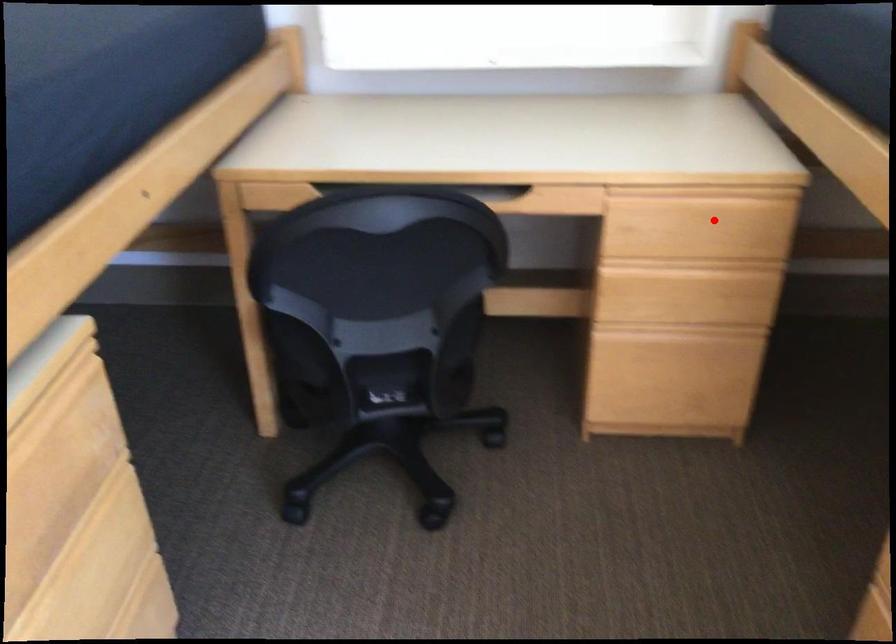
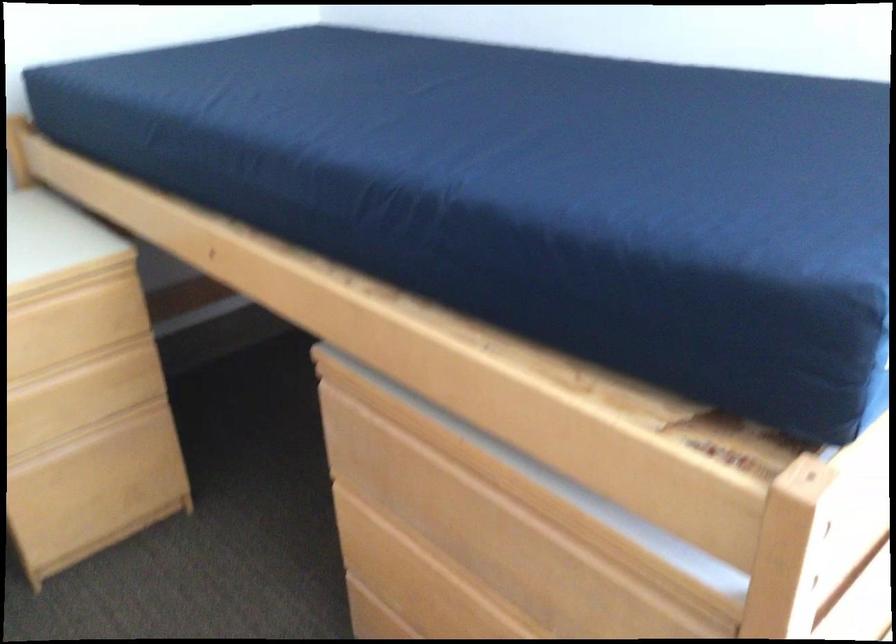
Find the pixel in the second image that matches the highlighted location in the first image.

(73, 323)